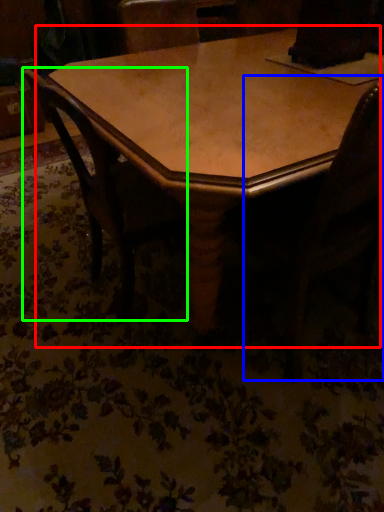
Question: Based on their relative distances, which object is nearer to table (highlighted by a red box)? Choose from swivel chair (highlighted by a blue box) and chair (highlighted by a green box).

Choices:
 (A) swivel chair
 (B) chair

Answer: (B)